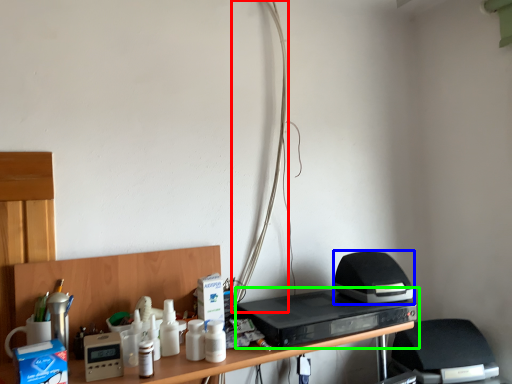
Question: Which object is positioned closest to wire (highlighted by a red box)? Select from appliance (highlighted by a blue box) and home appliance (highlighted by a green box).

Choices:
 (A) appliance
 (B) home appliance

Answer: (B)